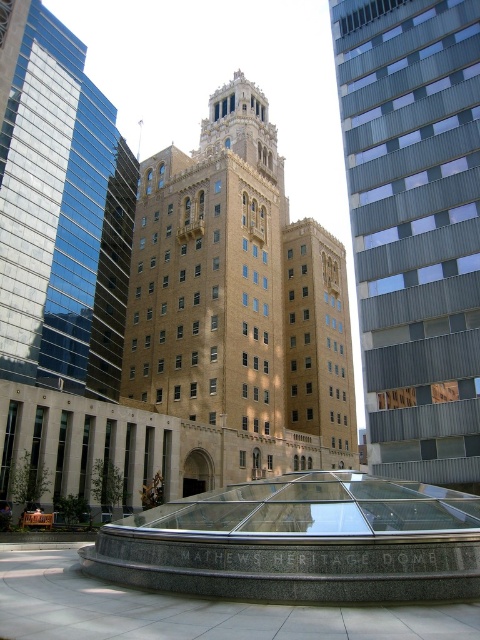
Who is positioned more to the right, metallic silver bell tower at center or brick tower at center?

metallic silver bell tower at center

Is metallic silver bell tower at center thinner than brick tower at center?

No.

Is point (427, 356) less distant than point (82, 189)?

Yes.

Where is `metallic silver bell tower at center`? This screenshot has height=640, width=480. metallic silver bell tower at center is located at coordinates (415, 227).

Who is more forward, (250,250) or (406,36)?

Positioned in front is point (406,36).

The image size is (480, 640). I want to click on brown brick bell tower at center, so click(239, 292).

What do you see at coordinates (239, 292) in the screenshot? I see `brown brick bell tower at center` at bounding box center [239, 292].

Where is `brown brick bell tower at center`? The image size is (480, 640). brown brick bell tower at center is located at coordinates (239, 292).

Can you confirm if brick tower at center is positioned above granite dome at center?

Correct, brick tower at center is located above granite dome at center.

Is point (75, 348) closer to camera compared to point (434, 566)?

No.

Who is more distant from viewer, (72, 164) or (316, 493)?

Point (72, 164)

This screenshot has width=480, height=640. Find the location of `brick tower at center`. brick tower at center is located at coordinates (60, 211).